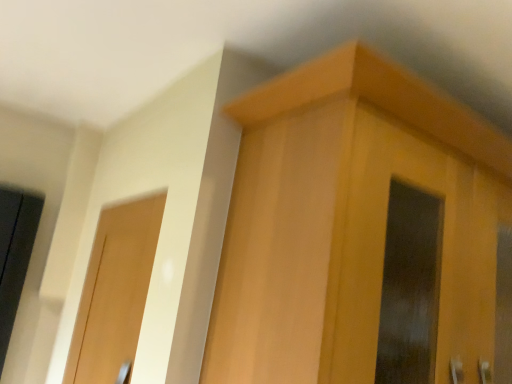
Where is `light wood cabinet at upper right`? light wood cabinet at upper right is located at coordinates (350, 222).

This screenshot has height=384, width=512. What do you see at coordinates (350, 222) in the screenshot? I see `light wood cabinet at upper right` at bounding box center [350, 222].

What is the approximate height of light wood cabinet at upper right?

light wood cabinet at upper right is 24.58 inches in height.

Locate an element on the screen. This screenshot has height=384, width=512. light wood cabinet at upper right is located at coordinates (350, 222).